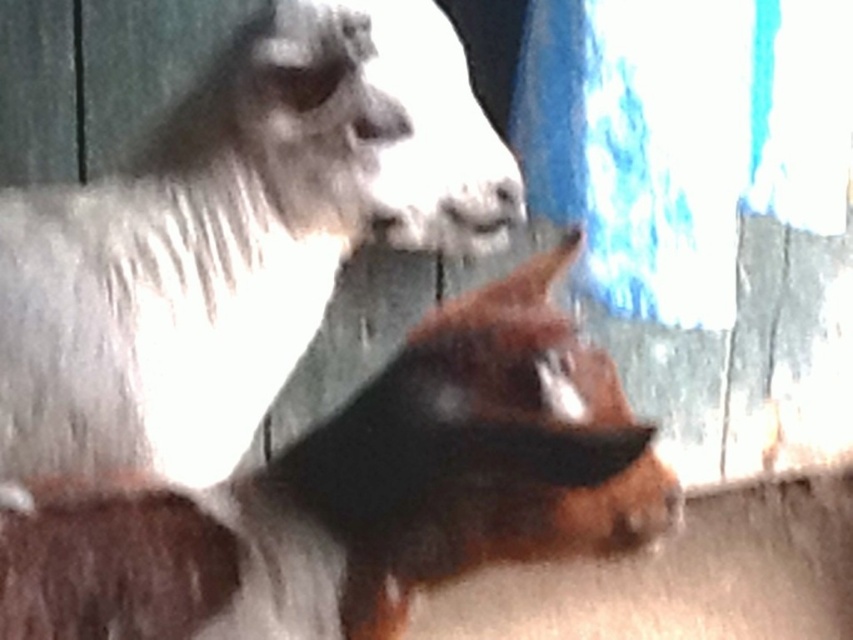
Who is more forward, (289, 72) or (138, 600)?

Positioned in front is point (138, 600).

Does brown woolen sheep at center have a greater height compared to brown furry dog at center?

Yes.

In the scene shown: Who is more distant from viewer, (276, 35) or (315, 586)?

The point (276, 35) is more distant.

Find the location of a particular element. This screenshot has width=853, height=640. brown woolen sheep at center is located at coordinates (236, 241).